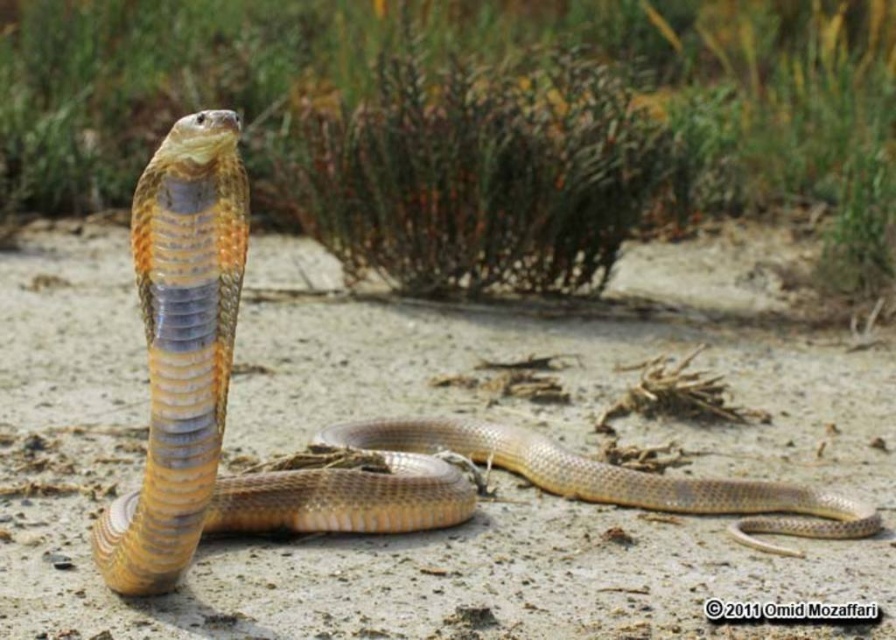
Question: Is smooth sand at center wider than shiny brown snake at center?

Choices:
 (A) no
 (B) yes

Answer: (B)

Question: Does smooth sand at center have a greater width compared to shiny brown snake at center?

Choices:
 (A) no
 (B) yes

Answer: (B)

Question: Which point is closer to the camera taking this photo?

Choices:
 (A) (714, 506)
 (B) (700, 330)

Answer: (A)

Question: Is smooth sand at center to the right of shiny brown snake at center from the viewer's perspective?

Choices:
 (A) yes
 (B) no

Answer: (A)

Question: Which point appears farthest from the camera in this image?

Choices:
 (A) (797, 531)
 (B) (841, 433)

Answer: (B)